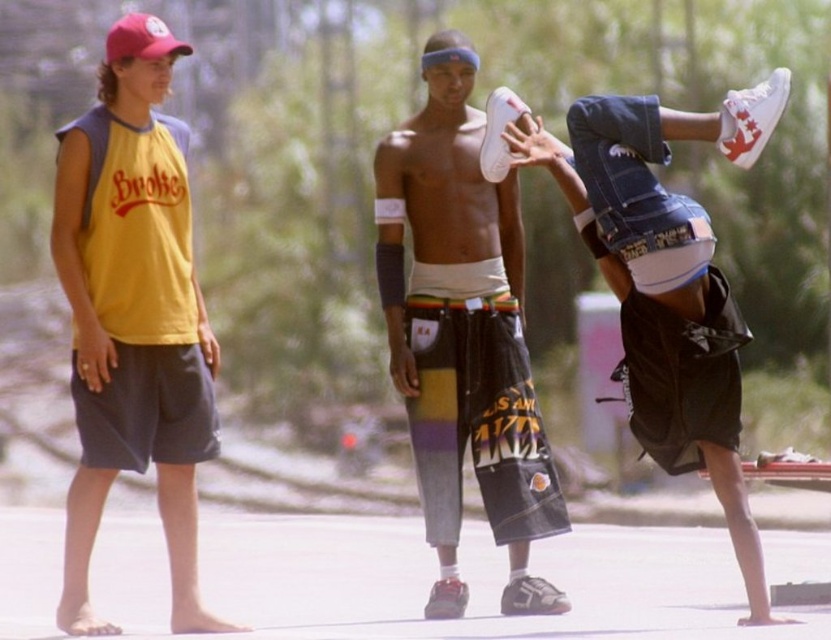
Question: Considering the relative positions of yellow fabric tank top at left and white matte sneakers at center in the image provided, where is yellow fabric tank top at left located with respect to white matte sneakers at center?

Choices:
 (A) above
 (B) below

Answer: (B)

Question: Can you confirm if white matte sneakers at center is wider than red fabric baseball cap at upper left?

Choices:
 (A) yes
 (B) no

Answer: (B)

Question: Which is nearer to the white matte sneakers at center?

Choices:
 (A) yellow fabric tank top at left
 (B) red fabric baseball cap at upper left
 (C) white cotton shorts at center

Answer: (C)

Question: Estimate the real-world distances between objects in this image. Which object is closer to the white cotton shorts at center?

Choices:
 (A) yellow fabric tank top at left
 (B) red fabric baseball cap at upper left
 (C) white matte sneakers at center

Answer: (C)

Question: Considering the real-world distances, which object is farthest from the white matte sneakers at center?

Choices:
 (A) red fabric baseball cap at upper left
 (B) white cotton shorts at center
 (C) yellow fabric tank top at left

Answer: (A)

Question: Can you confirm if white matte sneakers at center is thinner than red fabric baseball cap at upper left?

Choices:
 (A) yes
 (B) no

Answer: (A)